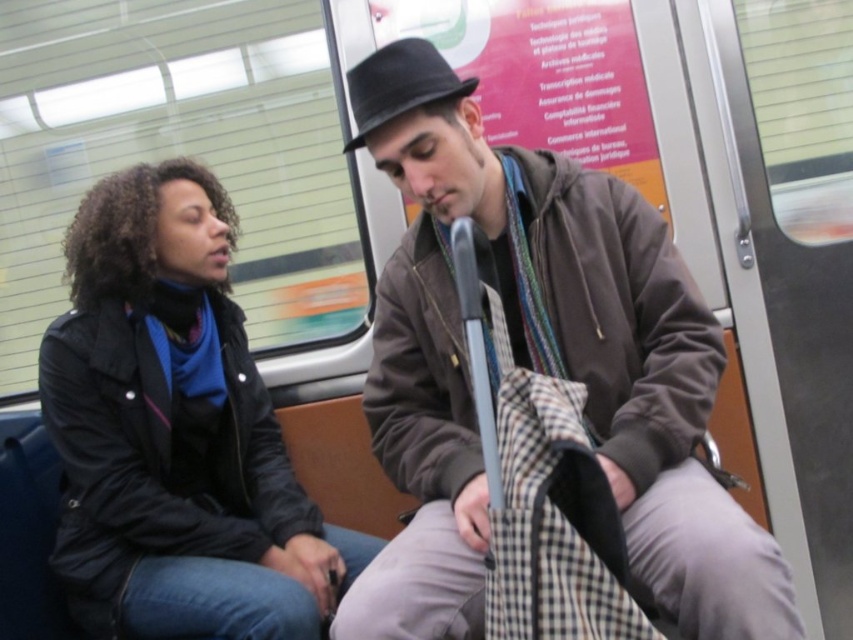
Is brown textured jacket at center smaller than black matte jacket at left?

Actually, brown textured jacket at center might be larger than black matte jacket at left.

Is point (440, 195) behind point (209, 508)?

No, (440, 195) is closer to viewer.

Which is in front, point (421, 627) or point (265, 580)?

Point (421, 627)

Identify the location of brown textured jacket at center. (540, 369).

Can you confirm if brown textured jacket at center is smaller than black felt fedora at center?

Incorrect, brown textured jacket at center is not smaller in size than black felt fedora at center.

The height and width of the screenshot is (640, 853). Find the location of `brown textured jacket at center`. brown textured jacket at center is located at coordinates (540, 369).

Does black matte jacket at left have a greater height compared to black felt fedora at center?

Yes, black matte jacket at left is taller than black felt fedora at center.

Does black matte jacket at left have a lesser height compared to black felt fedora at center?

Incorrect, black matte jacket at left's height does not fall short of black felt fedora at center's.

The image size is (853, 640). I want to click on black matte jacket at left, so pos(175,432).

Locate an element on the screen. This screenshot has height=640, width=853. black matte jacket at left is located at coordinates (175, 432).